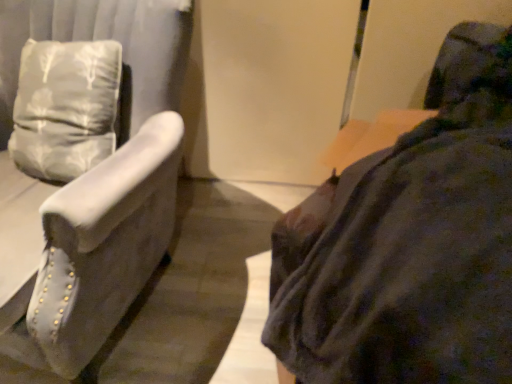
This screenshot has height=384, width=512. Identify the location of suede-like gray armchair at left, arranged as the first furniture when viewed from the left. (99, 249).

The height and width of the screenshot is (384, 512). What do you see at coordinates (99, 249) in the screenshot?
I see `suede-like gray armchair at left, arranged as the 2th furniture when viewed from the right` at bounding box center [99, 249].

The width and height of the screenshot is (512, 384). I want to click on dark fabric couch at right, the 1th furniture positioned from the right, so (x=410, y=243).

The height and width of the screenshot is (384, 512). Describe the element at coordinates (410, 243) in the screenshot. I see `dark fabric couch at right, the 1th furniture positioned from the right` at that location.

Find the location of `suede-like gray armchair at left, arranged as the 2th furniture when viewed from the right`. suede-like gray armchair at left, arranged as the 2th furniture when viewed from the right is located at coordinates (99, 249).

Is dark fabric couch at right, the second furniture when ordered from left to right, to the left of suede-like gray armchair at left, arranged as the first furniture when viewed from the left, from the viewer's perspective?

In fact, dark fabric couch at right, the second furniture when ordered from left to right, is to the right of suede-like gray armchair at left, arranged as the first furniture when viewed from the left.

Considering their positions, is dark fabric couch at right, the 1th furniture positioned from the right, located in front of or behind suede-like gray armchair at left, arranged as the first furniture when viewed from the left?

Clearly, dark fabric couch at right, the 1th furniture positioned from the right, is in front of suede-like gray armchair at left, arranged as the first furniture when viewed from the left.

Does point (432, 104) come behind point (46, 312)?

Yes, it is behind point (46, 312).

Looking at this image, from the image's perspective, relative to suede-like gray armchair at left, arranged as the 2th furniture when viewed from the right, is dark fabric couch at right, the 1th furniture positioned from the right, above or below?

Clearly, from the image's perspective, dark fabric couch at right, the 1th furniture positioned from the right, is below suede-like gray armchair at left, arranged as the 2th furniture when viewed from the right.

From a real-world perspective, which is physically below, dark fabric couch at right, the second furniture when ordered from left to right, or suede-like gray armchair at left, arranged as the first furniture when viewed from the left?

suede-like gray armchair at left, arranged as the first furniture when viewed from the left, from a real-world perspective.

Does dark fabric couch at right, the second furniture when ordered from left to right, have a lesser width compared to suede-like gray armchair at left, arranged as the first furniture when viewed from the left?

No.

Does dark fabric couch at right, the 1th furniture positioned from the right, have a greater height compared to suede-like gray armchair at left, arranged as the 2th furniture when viewed from the right?

No, dark fabric couch at right, the 1th furniture positioned from the right, is not taller than suede-like gray armchair at left, arranged as the 2th furniture when viewed from the right.

Considering the relative sizes of dark fabric couch at right, the second furniture when ordered from left to right, and suede-like gray armchair at left, arranged as the first furniture when viewed from the left, in the image provided, is dark fabric couch at right, the second furniture when ordered from left to right, bigger than suede-like gray armchair at left, arranged as the first furniture when viewed from the left,?

No.

Do you think dark fabric couch at right, the second furniture when ordered from left to right, is within suede-like gray armchair at left, arranged as the 2th furniture when viewed from the right, or outside of it?

dark fabric couch at right, the second furniture when ordered from left to right, is located beyond the bounds of suede-like gray armchair at left, arranged as the 2th furniture when viewed from the right.

Are dark fabric couch at right, the 1th furniture positioned from the right, and suede-like gray armchair at left, arranged as the 2th furniture when viewed from the right, located far from each other?

No.

Is dark fabric couch at right, the 1th furniture positioned from the right, oriented away from suede-like gray armchair at left, arranged as the 2th furniture when viewed from the right?

No, dark fabric couch at right, the 1th furniture positioned from the right, is not facing the opposite direction of suede-like gray armchair at left, arranged as the 2th furniture when viewed from the right.

You are a GUI agent. You are given a task and a screenshot of the screen. Output one action in this format:
    pyautogui.click(x=<x>, y=<y>)
    Task: Click on the furniture that is on the right side of suede-like gray armchair at left, arranged as the 2th furniture when viewed from the right
    This screenshot has width=512, height=384.
    Given the screenshot: What is the action you would take?
    pyautogui.click(x=410, y=243)

Between suede-like gray armchair at left, arranged as the 2th furniture when viewed from the right, and dark fabric couch at right, the 1th furniture positioned from the right, which one appears on the left side from the viewer's perspective?

suede-like gray armchair at left, arranged as the 2th furniture when viewed from the right.

Which is in front, suede-like gray armchair at left, arranged as the 2th furniture when viewed from the right, or dark fabric couch at right, the second furniture when ordered from left to right?

dark fabric couch at right, the second furniture when ordered from left to right, is in front.

Which is in front, point (115, 316) or point (492, 129)?

The point (492, 129) is closer to the camera.

From the image's perspective, which is below, suede-like gray armchair at left, arranged as the 2th furniture when viewed from the right, or dark fabric couch at right, the 1th furniture positioned from the right?

dark fabric couch at right, the 1th furniture positioned from the right, from the image's perspective.

From a real-world perspective, is suede-like gray armchair at left, arranged as the first furniture when viewed from the left, positioned under dark fabric couch at right, the second furniture when ordered from left to right, based on gravity?

Correct, in the physical world, suede-like gray armchair at left, arranged as the first furniture when viewed from the left, is lower than dark fabric couch at right, the second furniture when ordered from left to right.

Is suede-like gray armchair at left, arranged as the first furniture when viewed from the left, wider than dark fabric couch at right, the 1th furniture positioned from the right?

Incorrect, the width of suede-like gray armchair at left, arranged as the first furniture when viewed from the left, does not surpass that of dark fabric couch at right, the 1th furniture positioned from the right.

Does suede-like gray armchair at left, arranged as the 2th furniture when viewed from the right, have a greater height compared to dark fabric couch at right, the 1th furniture positioned from the right?

Yes, suede-like gray armchair at left, arranged as the 2th furniture when viewed from the right, is taller than dark fabric couch at right, the 1th furniture positioned from the right.

Does suede-like gray armchair at left, arranged as the 2th furniture when viewed from the right, have a smaller size compared to dark fabric couch at right, the second furniture when ordered from left to right?

Incorrect, suede-like gray armchair at left, arranged as the 2th furniture when viewed from the right, is not smaller in size than dark fabric couch at right, the second furniture when ordered from left to right.

Is dark fabric couch at right, the 1th furniture positioned from the right, located within suede-like gray armchair at left, arranged as the first furniture when viewed from the left?

No, dark fabric couch at right, the 1th furniture positioned from the right, is not inside suede-like gray armchair at left, arranged as the first furniture when viewed from the left.

Is suede-like gray armchair at left, arranged as the first furniture when viewed from the left, beside dark fabric couch at right, the 1th furniture positioned from the right?

No, suede-like gray armchair at left, arranged as the first furniture when viewed from the left, is not touching dark fabric couch at right, the 1th furniture positioned from the right.

Does suede-like gray armchair at left, arranged as the first furniture when viewed from the left, turn towards dark fabric couch at right, the 1th furniture positioned from the right?

No, suede-like gray armchair at left, arranged as the first furniture when viewed from the left, is not oriented towards dark fabric couch at right, the 1th furniture positioned from the right.

Could you measure the distance between suede-like gray armchair at left, arranged as the 2th furniture when viewed from the right, and dark fabric couch at right, the second furniture when ordered from left to right?

suede-like gray armchair at left, arranged as the 2th furniture when viewed from the right, and dark fabric couch at right, the second furniture when ordered from left to right, are 18.34 inches apart from each other.

The image size is (512, 384). Find the location of `furniture that appears below the suede-like gray armchair at left, arranged as the 2th furniture when viewed from the right (from the image's perspective)`. furniture that appears below the suede-like gray armchair at left, arranged as the 2th furniture when viewed from the right (from the image's perspective) is located at coordinates (410, 243).

The image size is (512, 384). I want to click on furniture directly beneath the dark fabric couch at right, the 1th furniture positioned from the right (from a real-world perspective), so click(x=99, y=249).

Locate an element on the screen. furniture below the suede-like gray armchair at left, arranged as the first furniture when viewed from the left (from the image's perspective) is located at coordinates (410, 243).